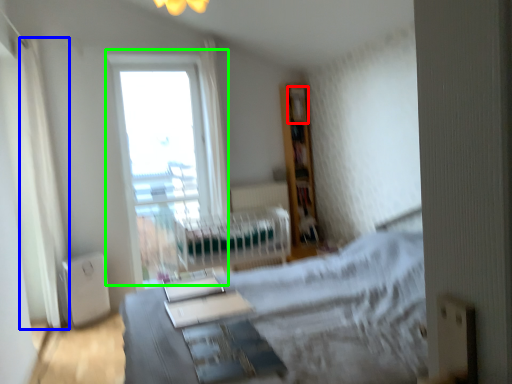
Question: Which object is the closest to the shelf (highlighted by a red box)? Choose among these: curtain (highlighted by a blue box) or window (highlighted by a green box).

Choices:
 (A) curtain
 (B) window

Answer: (B)